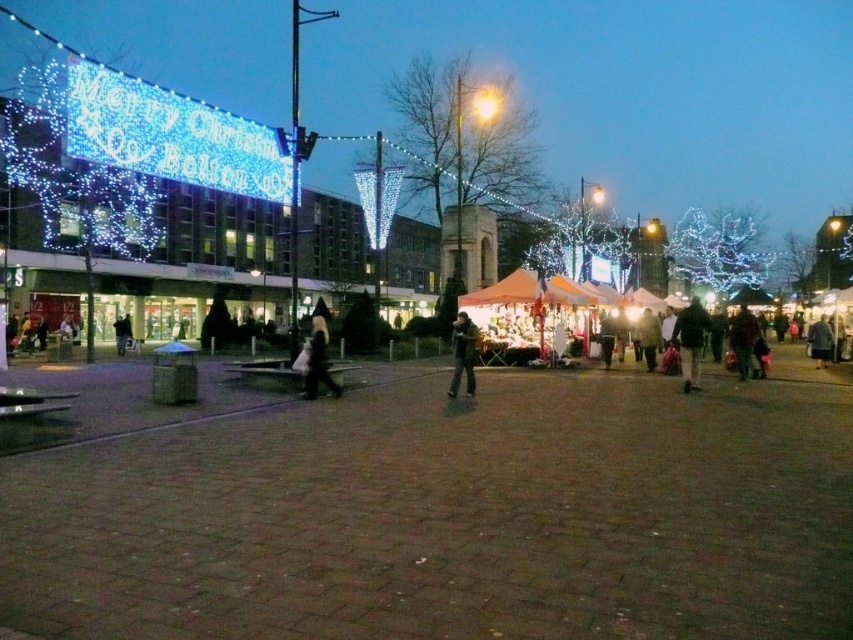
You are attending a winter festival and see two people wearing dark gray outerwear. One is wearing a dark gray jacket at center and the other a dark gray coat at right. Which person is wearing the smaller sized outerwear?

The dark gray jacket at center has a smaller size compared to the dark gray coat at right, so the person wearing the dark gray jacket at center is wearing the smaller sized outerwear.

You are standing in the festive square and see two dark gray outerwear items. The dark gray jacket at center and the dark gray coat at right. Which one is nearer to you?

The dark gray jacket at center is closer to the viewer than the dark gray coat at right, so the dark gray jacket at center is nearer to you.